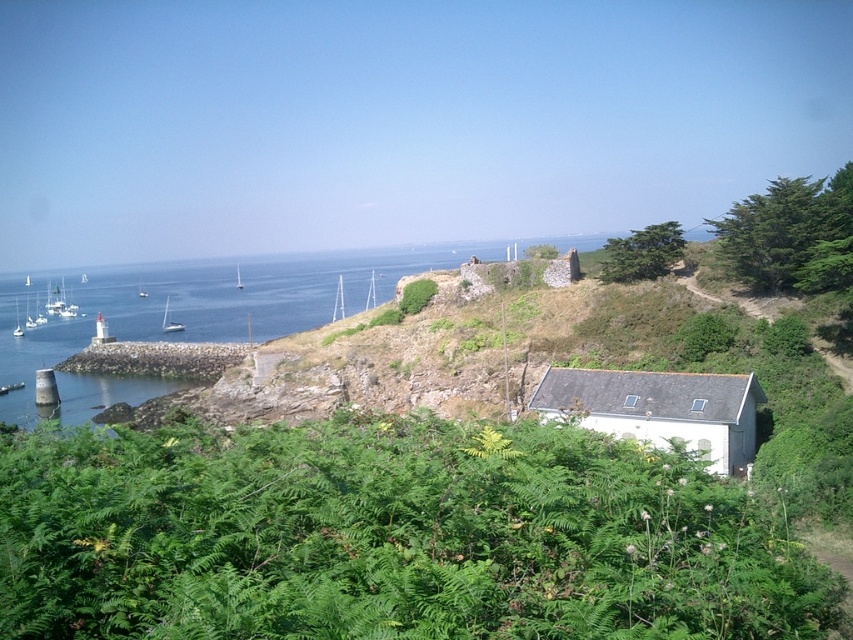
Is green leafy shrub at upper right to the right of white glossy sailboat at left from the viewer's perspective?

Correct, you'll find green leafy shrub at upper right to the right of white glossy sailboat at left.

Between green leafy shrub at upper right and white glossy sailboat at left, which one has more height?

white glossy sailboat at left is taller.

Is point (618, 246) closer to camera compared to point (167, 316)?

Yes, point (618, 246) is in front of point (167, 316).

The width and height of the screenshot is (853, 640). Find the location of `green leafy shrub at upper right`. green leafy shrub at upper right is located at coordinates (642, 253).

Is white plastic sailboat at center to the right of white sailboat at left from the viewer's perspective?

Yes, white plastic sailboat at center is to the right of white sailboat at left.

Between point (334, 308) and point (238, 273), which one is positioned in front?

Point (334, 308) is in front.

Describe the element at coordinates (338, 300) in the screenshot. I see `white plastic sailboat at center` at that location.

Image resolution: width=853 pixels, height=640 pixels. I want to click on white plastic sailboat at center, so click(x=338, y=300).

From the picture: Can you confirm if green leafy bush at center is positioned to the left of white glossy sailboat at left?

No, green leafy bush at center is not to the left of white glossy sailboat at left.

Between green leafy bush at center and white glossy sailboat at left, which one has more height?

With more height is white glossy sailboat at left.

Find the location of a particular element. The width and height of the screenshot is (853, 640). green leafy bush at center is located at coordinates (416, 296).